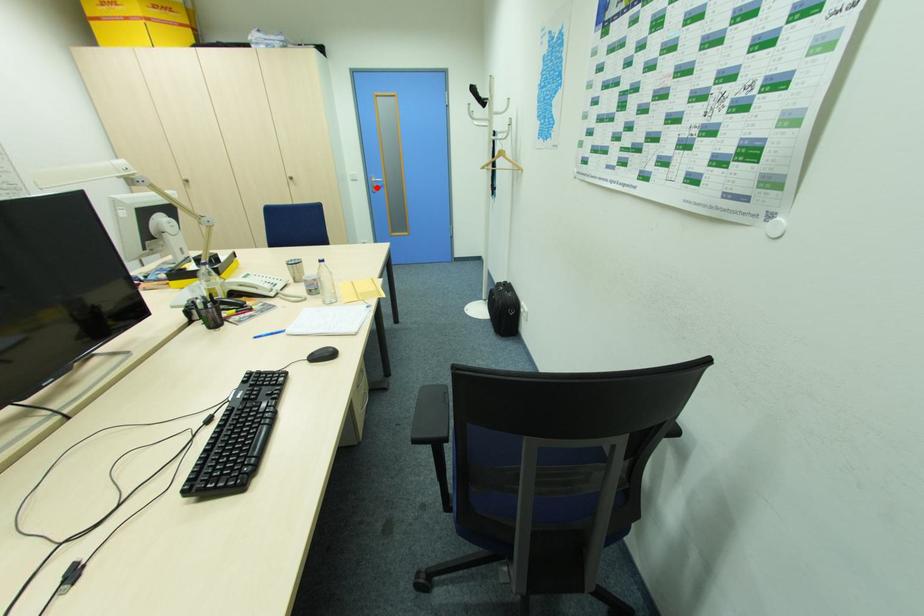
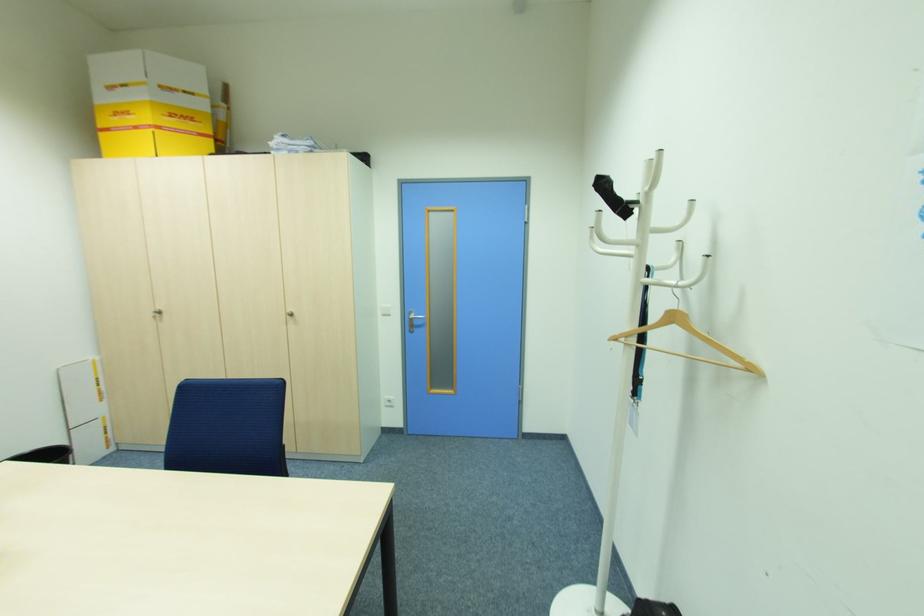
Question: I am providing you with two images of the same scene from different viewpoints. A red point is shown in image1. For the corresponding object point in image2, is it positioned nearer or farther from the camera?

Choices:
 (A) Nearer
 (B) Farther

Answer: (B)